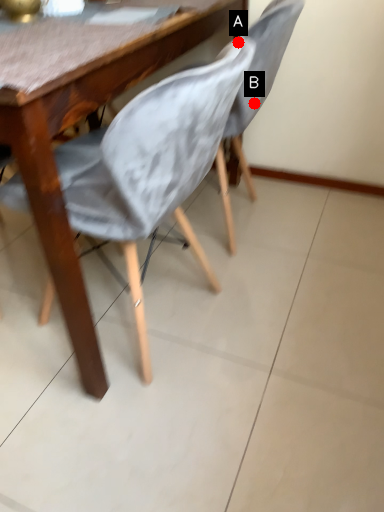
Question: Two points are circled on the image, labeled by A and B beside each circle. Which point is farther from the camera taking this photo?

Choices:
 (A) A is further
 (B) B is further

Answer: (B)